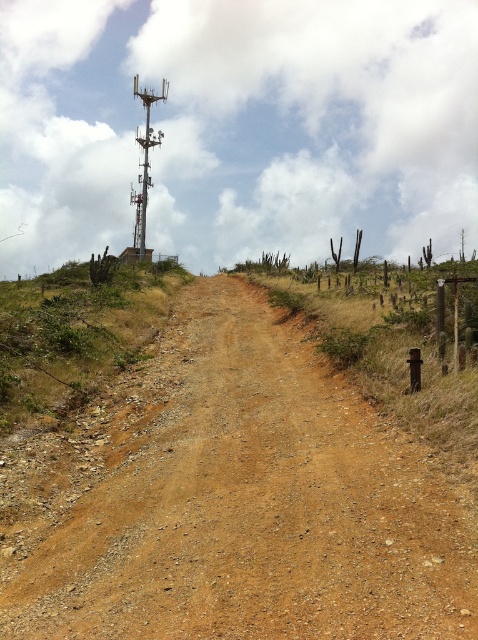
Question: Which point appears closest to the camera in this image?

Choices:
 (A) pyautogui.click(x=72, y=380)
 (B) pyautogui.click(x=202, y=586)

Answer: (B)

Question: Is brown gravelly dirt track at center wider than green grassy hillside at upper left?

Choices:
 (A) yes
 (B) no

Answer: (B)

Question: Does brown gravelly dirt track at center have a smaller size compared to green grassy hillside at upper left?

Choices:
 (A) no
 (B) yes

Answer: (B)

Question: Does brown gravelly dirt track at center appear on the left side of green grassy hillside at upper left?

Choices:
 (A) yes
 (B) no

Answer: (B)